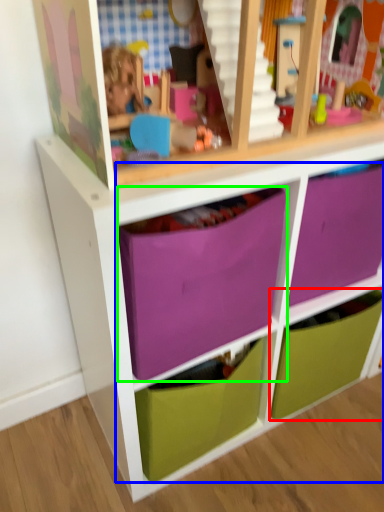
Question: Based on their relative distances, which object is nearer to drawer (highlighted by a red box)? Choose from drawer (highlighted by a blue box) and drawer (highlighted by a green box).

Choices:
 (A) drawer
 (B) drawer

Answer: (A)